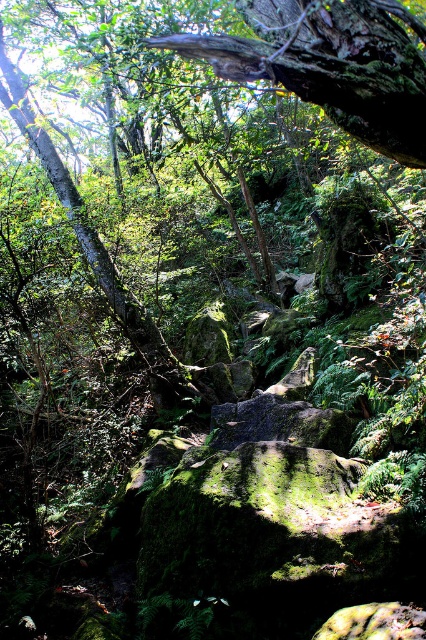
In the scene shown: Is green mossy tree trunk at upper center shorter than green mossy tree trunk at upper left?

No.

Is green mossy tree trunk at upper center positioned before green mossy tree trunk at upper left?

Yes, green mossy tree trunk at upper center is in front of green mossy tree trunk at upper left.

The width and height of the screenshot is (426, 640). What do you see at coordinates (331, 65) in the screenshot?
I see `green mossy tree trunk at upper center` at bounding box center [331, 65].

At what (x,y) coordinates should I click in order to perform the action: click on green mossy tree trunk at upper center. Please return your answer as a coordinate pair (x, y). Looking at the image, I should click on (331, 65).